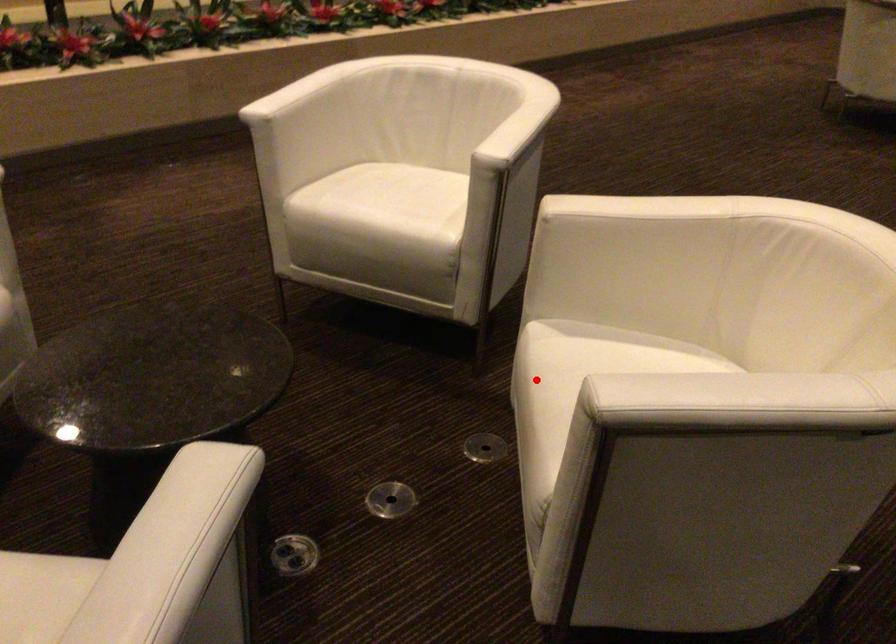
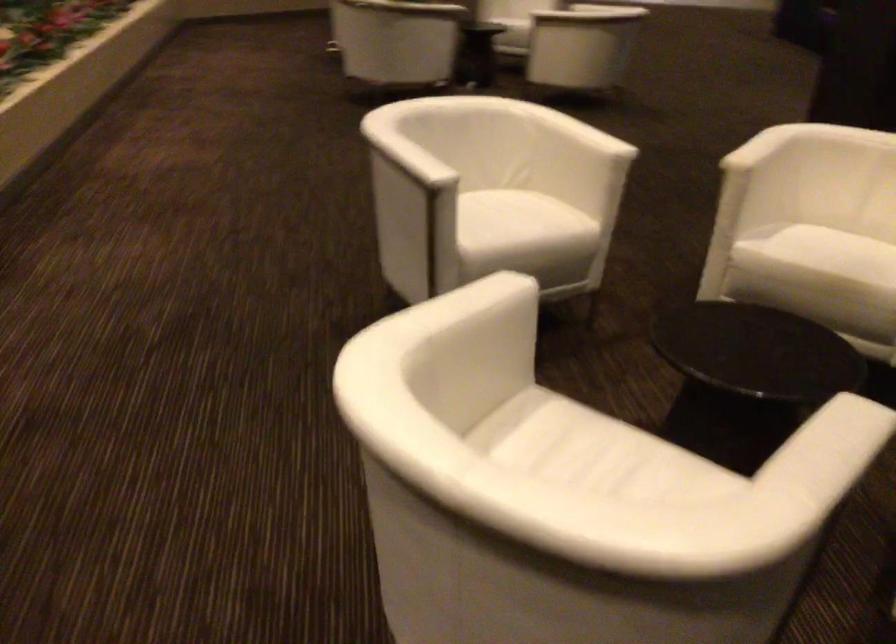
In the second image, find the point that corresponds to the highlighted location in the first image.

(836, 252)